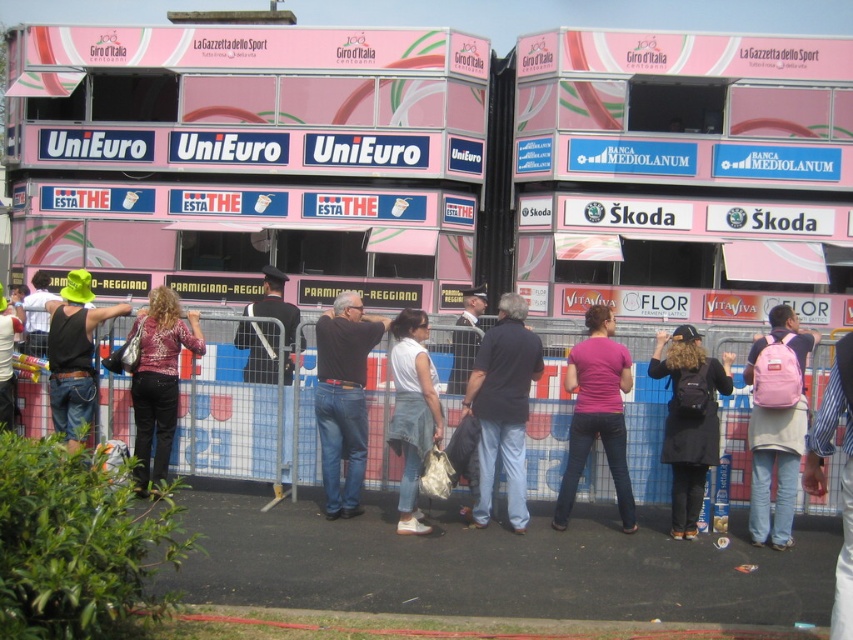
You are a photographer at the Giro d Italia event. You want to take a photo of the white denim jeans at center without the pink fabric backpack at center right blocking it. Is this possible given their positions?

The pink fabric backpack at center right is further to the viewer than white denim jeans at center, so it is blocking the view. Therefore, it is not possible to take a photo of the white denim jeans at center without the backpack obstructing it.

You are standing at the point marked by the coordinates point (776, 428). What object is located exactly at that point?

The point (776, 428) marks the pink fabric backpack at center right.

You are a photographer at the event and need to capture a photo of both the pink backpack at center and the denim jacket at left without moving your position. Can you fit both items in your camera frame if your camera has a maximum horizontal field of view of 25 feet?

The distance between the pink backpack at center and the denim jacket at left is 26.69 feet, which exceeds the camera frame limit of 25 feet. Therefore, you cannot fit both items in the frame without moving your position.